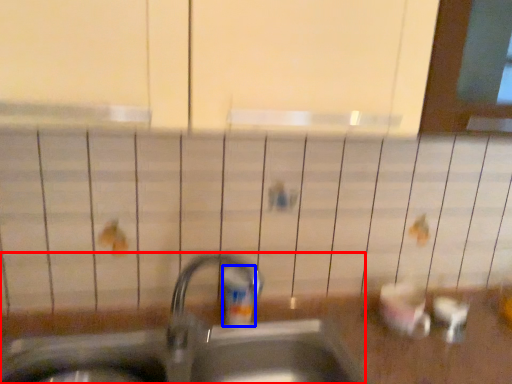
Question: Which point is further to the camera, sink (highlighted by a red box) or toiletry (highlighted by a blue box)?

Choices:
 (A) sink
 (B) toiletry

Answer: (B)